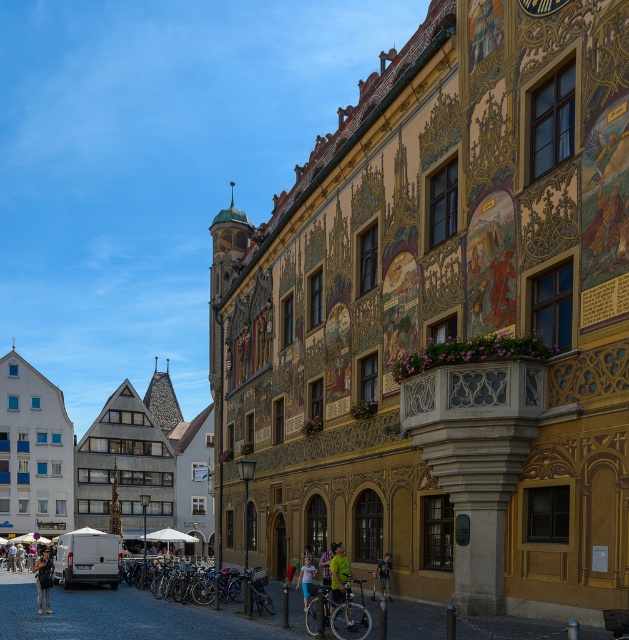
Question: Is denim jacket at lower left positioned at the back of green fabric jacket at center?

Choices:
 (A) yes
 (B) no

Answer: (B)

Question: Is green fabric jacket at center positioned behind light blue denim shorts at lower center?

Choices:
 (A) yes
 (B) no

Answer: (A)

Question: Estimate the real-world distances between objects in this image. Which object is closer to the white textured building at center?

Choices:
 (A) denim jacket at lower left
 (B) green fabric jacket at center
 (C) light blue denim shorts at lower center
 (D) green jersey at center

Answer: (A)

Question: Can you confirm if denim jacket at lower left is positioned to the right of light blue denim shorts at lower center?

Choices:
 (A) no
 (B) yes

Answer: (A)

Question: Which object is the closest to the white textured building at center?

Choices:
 (A) denim jacket at lower left
 (B) light blue denim shorts at lower center
 (C) green jersey at center

Answer: (A)

Question: Which object is closer to the camera taking this photo?

Choices:
 (A) green fabric jacket at center
 (B) light blue denim shorts at lower center
 (C) green jersey at center

Answer: (C)